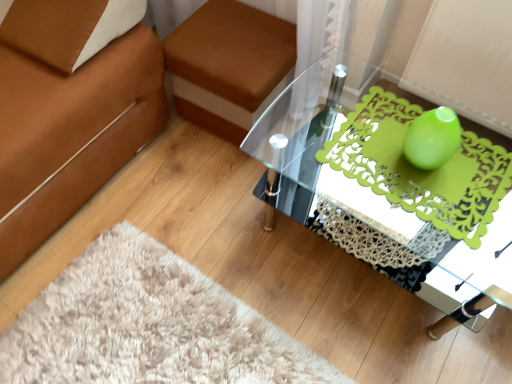
Question: From the image's perspective, is green matte vase at upper right located above or below brown fabric footrest at upper center?

Choices:
 (A) above
 (B) below

Answer: (B)

Question: From their relative heights in the image, would you say green matte vase at upper right is taller or shorter than brown fabric footrest at upper center?

Choices:
 (A) tall
 (B) short

Answer: (B)

Question: Which of these objects is positioned closest to the brown fabric footrest at upper center?

Choices:
 (A) teal glass vase at center
 (B) green matte vase at upper right
 (C) transparent glass table at center

Answer: (C)

Question: Estimate the real-world distances between objects in this image. Which object is farther from the green matte vase at upper right?

Choices:
 (A) brown fabric footrest at upper center
 (B) teal glass vase at center
 (C) transparent glass table at center

Answer: (A)